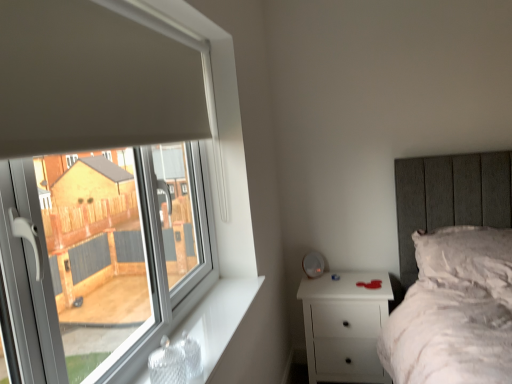
Question: Is white plastic window at left in front of or behind white fluffy pillow at upper right in the image?

Choices:
 (A) behind
 (B) front

Answer: (B)

Question: Is point (15, 269) positioned closer to the camera than point (505, 284)?

Choices:
 (A) closer
 (B) farther

Answer: (A)

Question: Considering the real-world distances, which object is closest to the white matte nightstand at lower right?

Choices:
 (A) white plastic window at left
 (B) white fluffy pillow at upper right
 (C) white glossy window sill at lower left

Answer: (B)

Question: Considering the real-world distances, which object is farthest from the white plastic window at left?

Choices:
 (A) white matte nightstand at lower right
 (B) white glossy window sill at lower left
 (C) white fluffy pillow at upper right

Answer: (C)